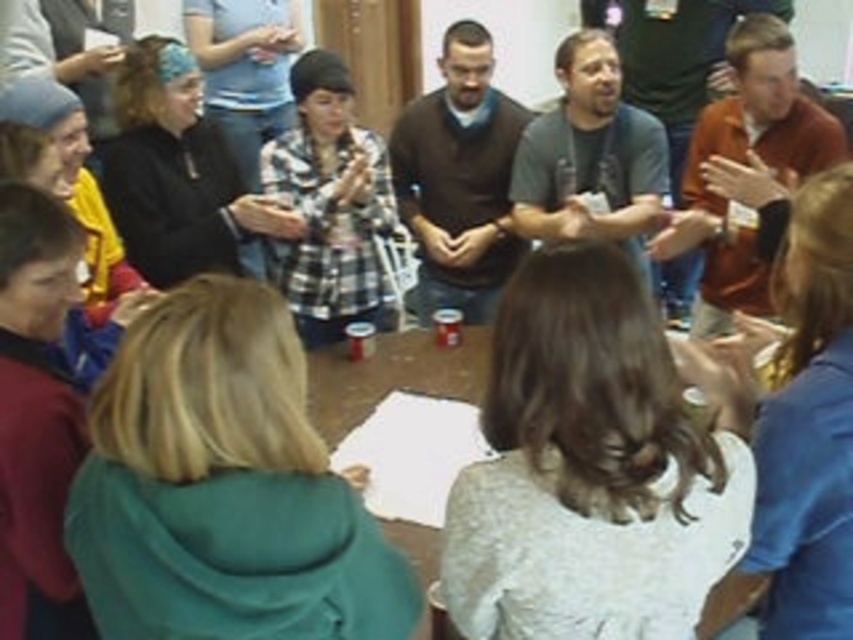
Which is more to the right, green fleece jacket at lower left or white textured sweater at center?

From the viewer's perspective, white textured sweater at center appears more on the right side.

Which is above, green fleece jacket at lower left or white textured sweater at center?

Positioned higher is white textured sweater at center.

Is point (299, 422) behind point (607, 528)?

No, it is not.

Where is `green fleece jacket at lower left`? Image resolution: width=853 pixels, height=640 pixels. green fleece jacket at lower left is located at coordinates (223, 486).

Does green fleece jacket at lower left appear on the left side of brown sweater at center?

Yes, green fleece jacket at lower left is to the left of brown sweater at center.

Does green fleece jacket at lower left have a greater height compared to brown sweater at center?

No.

I want to click on green fleece jacket at lower left, so click(x=223, y=486).

Does blue fabric shirt at upper right have a lesser width compared to maroon fleece jacket at lower left?

In fact, blue fabric shirt at upper right might be wider than maroon fleece jacket at lower left.

Which is more to the left, blue fabric shirt at upper right or maroon fleece jacket at lower left?

From the viewer's perspective, maroon fleece jacket at lower left appears more on the left side.

Is point (822, 420) positioned behind point (22, 243)?

No, (822, 420) is closer to viewer.

Locate an element on the screen. This screenshot has height=640, width=853. blue fabric shirt at upper right is located at coordinates (804, 433).